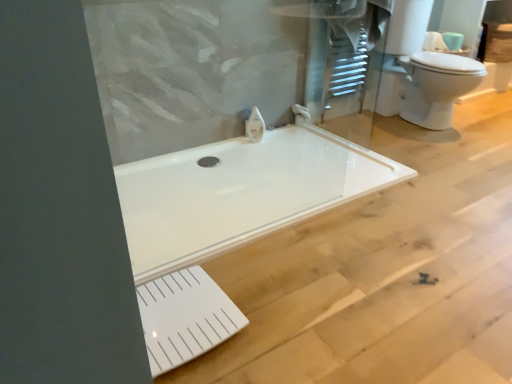
Locate an element on the screen. free location to the right of white glossy faucet at upper center, arranged as the first faucet when viewed from the back is located at coordinates (329, 123).